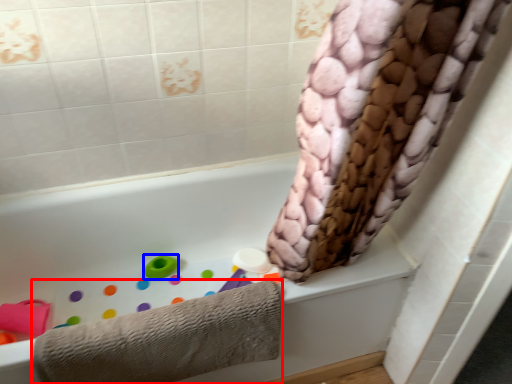
Question: Which object is further to the camera taking this photo, towel (highlighted by a red box) or toy (highlighted by a blue box)?

Choices:
 (A) towel
 (B) toy

Answer: (B)